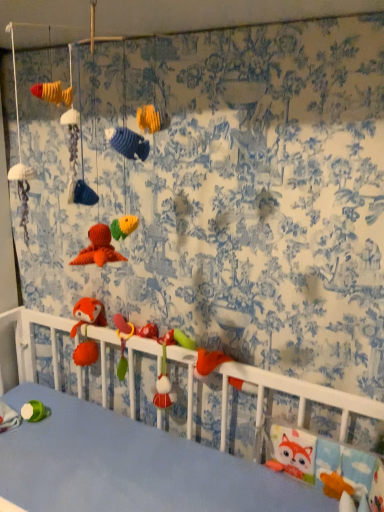
Question: From a real-world perspective, is rubber duck at center, arranged as the second toy when viewed from the left, physically located above or below white plush toy at lower left, which is the second toy in right-to-left order?

Choices:
 (A) below
 (B) above

Answer: (B)

Question: Looking at their shapes, would you say rubber duck at center, the 1th toy from the right, is wider or thinner than white plush toy at lower left, the 1th toy in the left-to-right sequence?

Choices:
 (A) wide
 (B) thin

Answer: (B)

Question: Based on their sizes in the image, would you say rubber duck at center, the 1th toy when ordered from top to bottom, is bigger or smaller than white plush toy at lower left, placed as the 2th toy when sorted from top to bottom?

Choices:
 (A) big
 (B) small

Answer: (B)

Question: From the image's perspective, is white plush toy at lower left, which is the second toy in right-to-left order, located above or below rubber duck at center, placed as the second toy when sorted from bottom to top?

Choices:
 (A) below
 (B) above

Answer: (A)

Question: Would you say white plush toy at lower left, the 1th toy in the left-to-right sequence, is to the left or to the right of rubber duck at center, placed as the second toy when sorted from bottom to top, in the picture?

Choices:
 (A) left
 (B) right

Answer: (A)

Question: Looking at the image, does white plush toy at lower left, the 1th toy positioned from the bottom, seem bigger or smaller compared to rubber duck at center, the 1th toy from the right?

Choices:
 (A) big
 (B) small

Answer: (A)

Question: Is white plush toy at lower left, the 1th toy positioned from the bottom, wider or thinner than rubber duck at center, the 1th toy when ordered from top to bottom?

Choices:
 (A) thin
 (B) wide

Answer: (B)